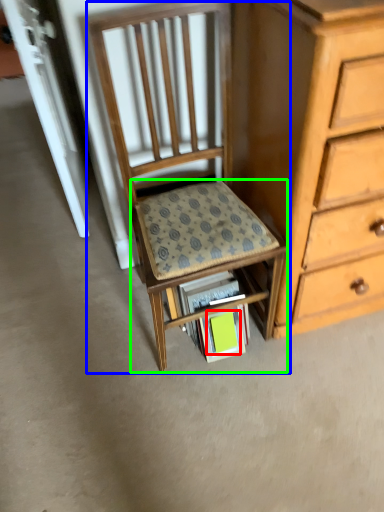
Question: Considering the real-world distances, which object is closest to paperback book (highlighted by a red box)? chair (highlighted by a blue box) or step stool (highlighted by a green box).

Choices:
 (A) chair
 (B) step stool

Answer: (B)